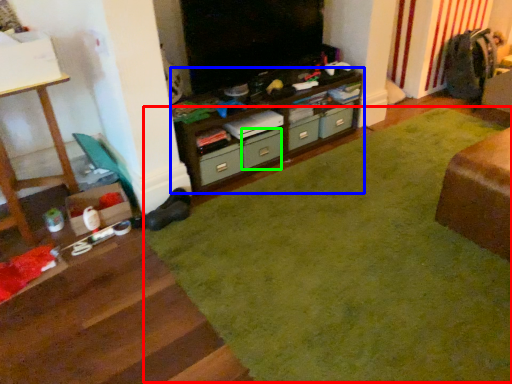
Question: Estimate the real-world distances between objects in this image. Which object is farther from plain (highlighted by a red box), cabinetry (highlighted by a blue box) or drawer (highlighted by a green box)?

Choices:
 (A) cabinetry
 (B) drawer

Answer: (B)